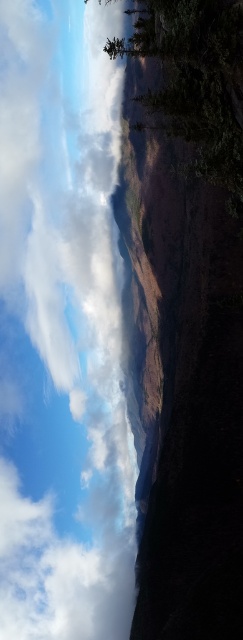
Looking at this image, is white fluffy cloud at upper left positioned in front of green matte tree at upper center?

That is False.

What do you see at coordinates (62, 330) in the screenshot? I see `white fluffy cloud at upper left` at bounding box center [62, 330].

At what (x,y) coordinates should I click in order to perform the action: click on white fluffy cloud at upper left. Please return your answer as a coordinate pair (x, y). Looking at the image, I should click on coord(62,330).